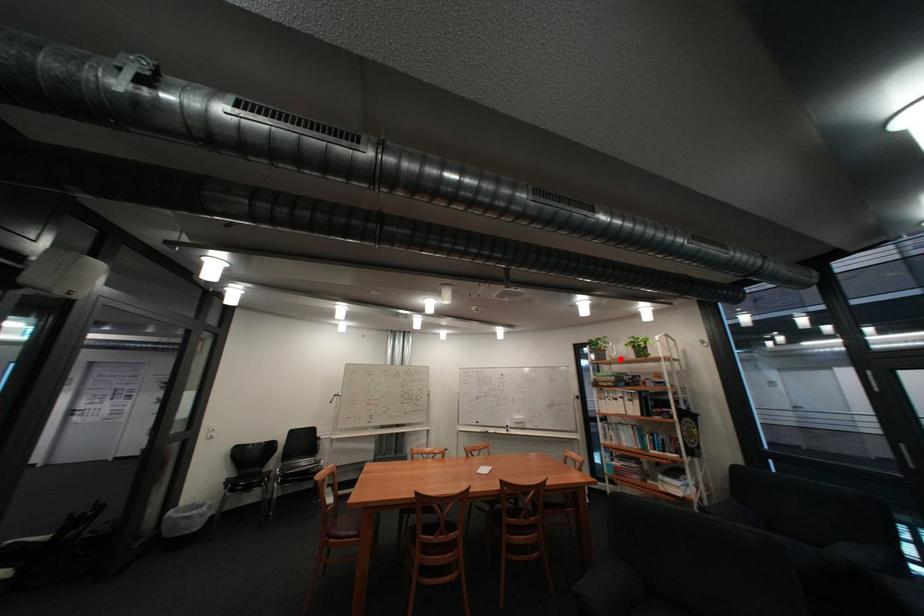
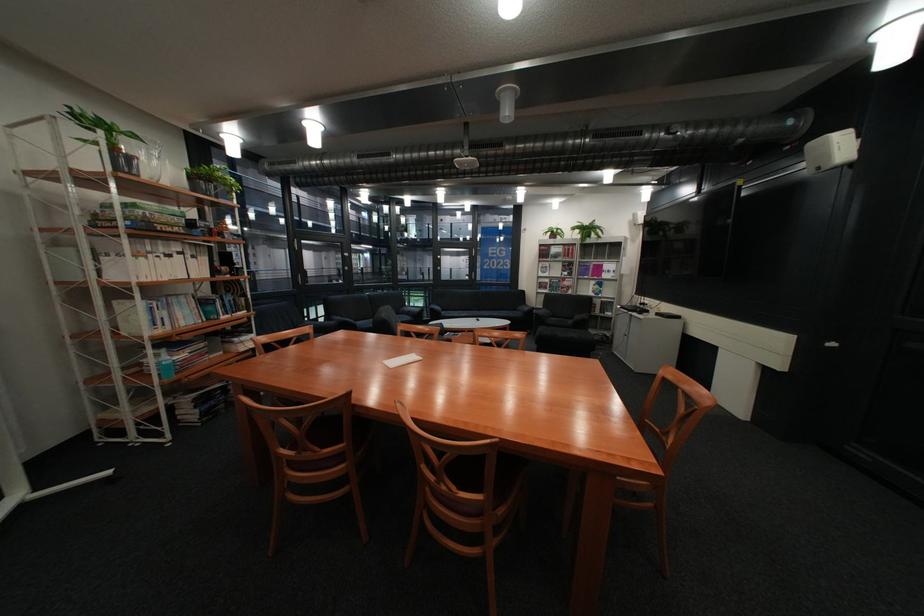
Locate, in the second image, the point that corresponds to the highlighted location in the first image.

(152, 177)